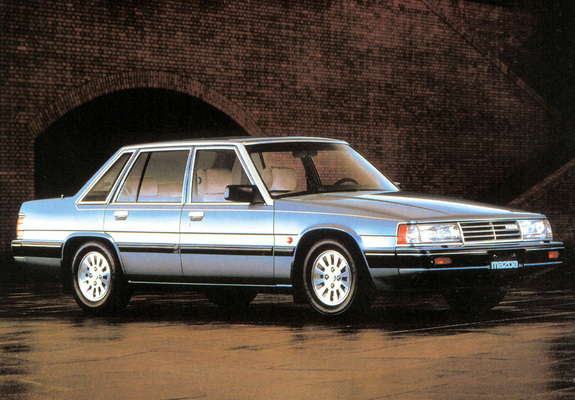
The height and width of the screenshot is (400, 575). What are the coordinates of `windows` in the screenshot? It's located at (218, 168), (163, 171).